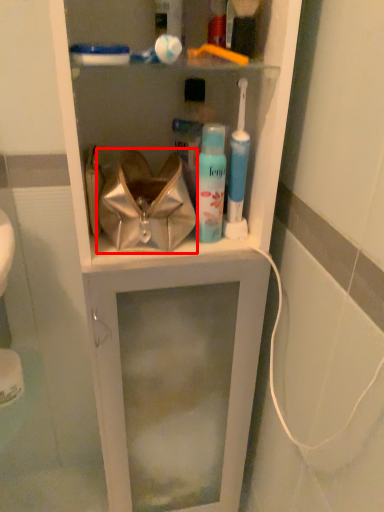
Question: From the image's perspective, what is the correct spatial positioning of handbag (annotated by the red box) in reference to toiletry?

Choices:
 (A) above
 (B) below

Answer: (A)